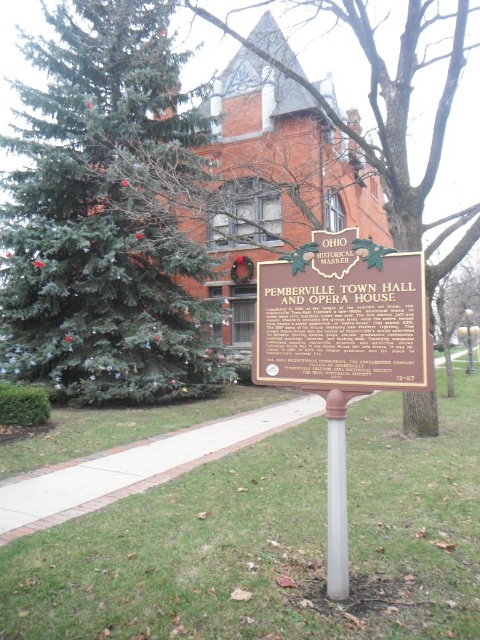
Question: Which point appears closest to the camera in this image?

Choices:
 (A) (460, 49)
 (B) (88, 260)

Answer: (A)

Question: Can you confirm if green textured pine tree at left is positioned to the right of green textured pine tree at upper left?

Choices:
 (A) yes
 (B) no

Answer: (B)

Question: From the image, what is the correct spatial relationship of brown polished wood sign at center in relation to green textured pine tree at upper left?

Choices:
 (A) right
 (B) left

Answer: (B)

Question: Based on their relative distances, which object is farther from the green textured pine tree at left?

Choices:
 (A) white plastic pole at center
 (B) brown polished wood sign at center
 (C) green textured pine tree at upper left

Answer: (A)

Question: In this image, where is green textured pine tree at left located relative to green textured pine tree at upper left?

Choices:
 (A) above
 (B) below

Answer: (B)

Question: Which is farther from the green textured pine tree at upper left?

Choices:
 (A) brown polished wood sign at center
 (B) green textured pine tree at left
 (C) white plastic pole at center

Answer: (C)